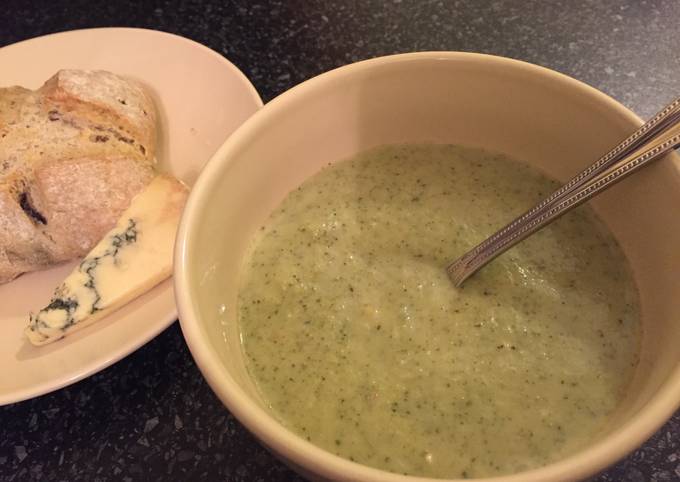
The width and height of the screenshot is (680, 482). I want to click on edge of white bowl, so click(x=177, y=288).